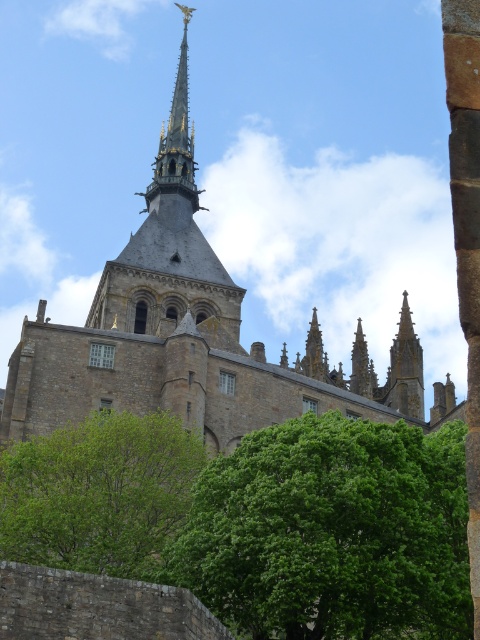
How far apart are green leafy tree at center and green leafy tree at lower left?

The distance of green leafy tree at center from green leafy tree at lower left is 6.64 meters.

Who is shorter, green leafy tree at center or green leafy tree at lower left?

Standing shorter between the two is green leafy tree at lower left.

Which is in front, point (285, 422) or point (44, 531)?

Point (44, 531) is more forward.

This screenshot has height=640, width=480. What are the coordinates of `green leafy tree at center` in the screenshot? It's located at (332, 532).

Who is taller, green leafy tree at center or dark gray stone church tower at center?

dark gray stone church tower at center is taller.

Is point (225, 534) positioned behind point (204, 248)?

No, it is in front of (204, 248).

At what (x,y) coordinates should I click in order to perform the action: click on green leafy tree at center. Please return your answer as a coordinate pair (x, y). Looking at the image, I should click on (332, 532).

Which is below, green leafy tree at lower left or dark gray stone church tower at center?

Positioned lower is green leafy tree at lower left.

Is green leafy tree at lower left shorter than dark gray stone church tower at center?

Correct, green leafy tree at lower left is not as tall as dark gray stone church tower at center.

Which is in front, point (116, 474) or point (152, 253)?

Point (116, 474) is more forward.

Locate an element on the screen. The width and height of the screenshot is (480, 640). green leafy tree at lower left is located at coordinates (98, 493).